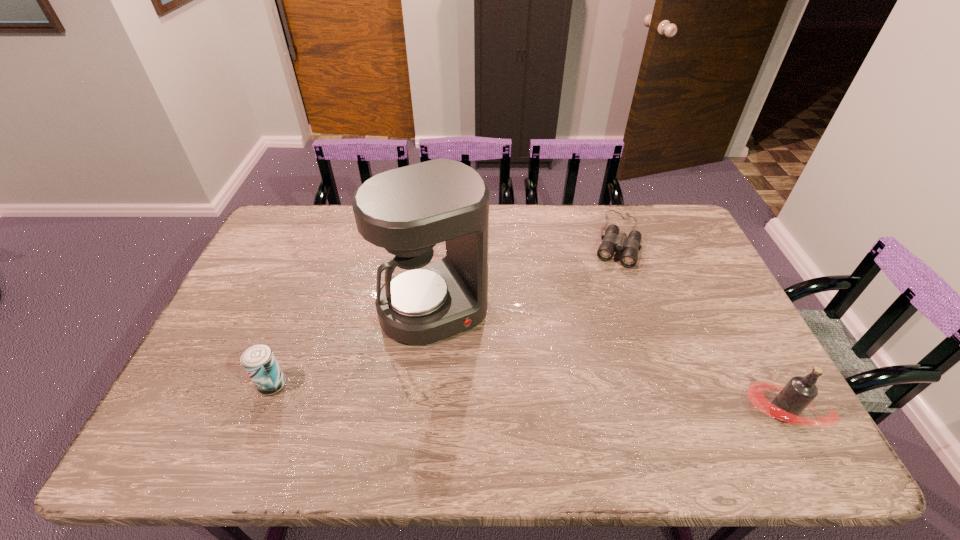
Locate an element on the screen. Image resolution: width=960 pixels, height=540 pixels. blank area at the far edge is located at coordinates (317, 231).

In the image, there is a desktop. Where is `vacant space at the near edge`? Image resolution: width=960 pixels, height=540 pixels. vacant space at the near edge is located at coordinates (469, 397).

The height and width of the screenshot is (540, 960). What are the coordinates of `free space at the left edge of the desktop` in the screenshot? It's located at (243, 326).

In the image, there is a desktop. At what (x,y) coordinates should I click in order to perform the action: click on vacant area at the right edge. Please return your answer as a coordinate pair (x, y). The image size is (960, 540). Looking at the image, I should click on (707, 349).

Image resolution: width=960 pixels, height=540 pixels. What are the coordinates of `free space at the far left corner` in the screenshot? It's located at (312, 223).

Identify the location of blank region between the leftmost object and the root beer. The height and width of the screenshot is (540, 960). (527, 399).

Identify the location of vacant point located between the root beer and the coffee maker. The width and height of the screenshot is (960, 540). (608, 361).

Identify the location of empty location between the tallest object and the rightmost object. The image size is (960, 540). (608, 361).

This screenshot has height=540, width=960. In order to click on free point between the root beer and the second farthest object in this screenshot , I will do `click(608, 361)`.

Find the location of a particular element. The width and height of the screenshot is (960, 540). free point between the third nearest object and the leftmost object is located at coordinates (353, 347).